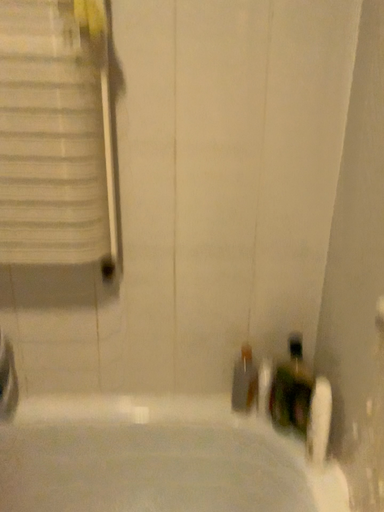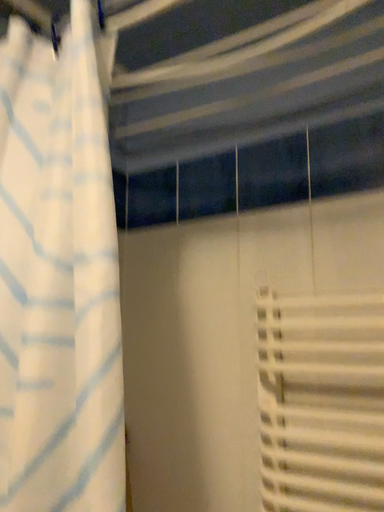
Question: Which way did the camera rotate in the video?

Choices:
 (A) rotated left
 (B) rotated right

Answer: (A)